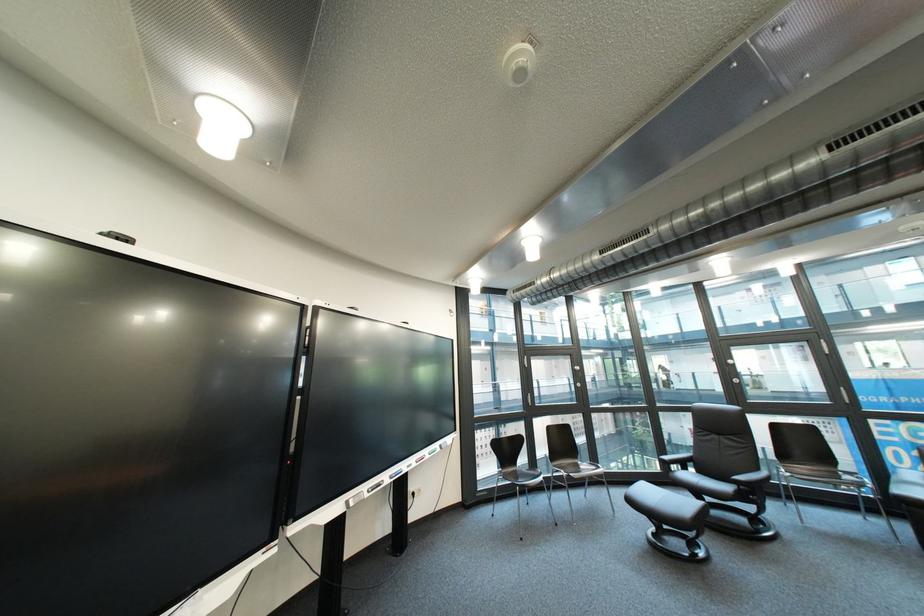
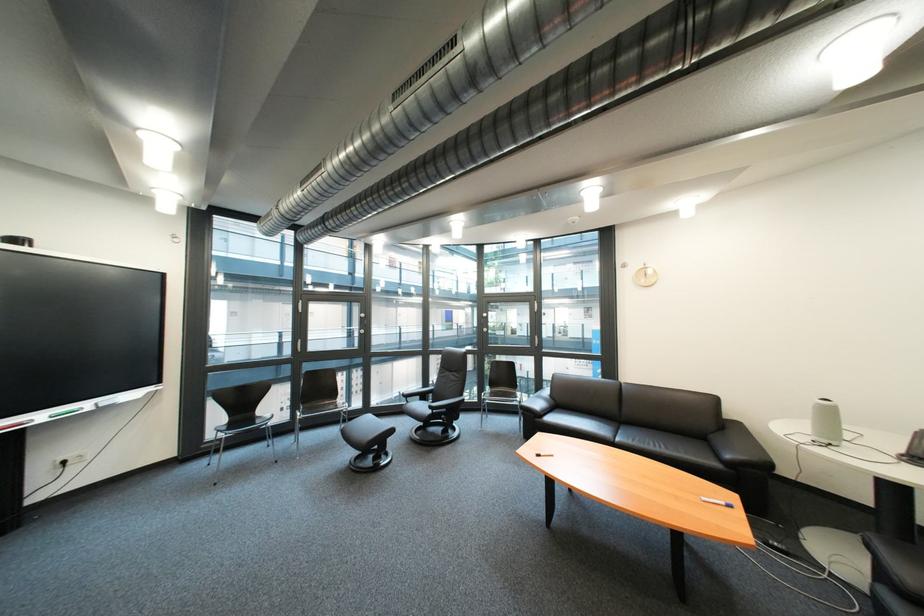
Locate, in the second image, the point that corresponds to point 508,386 in the first image.

(363, 331)